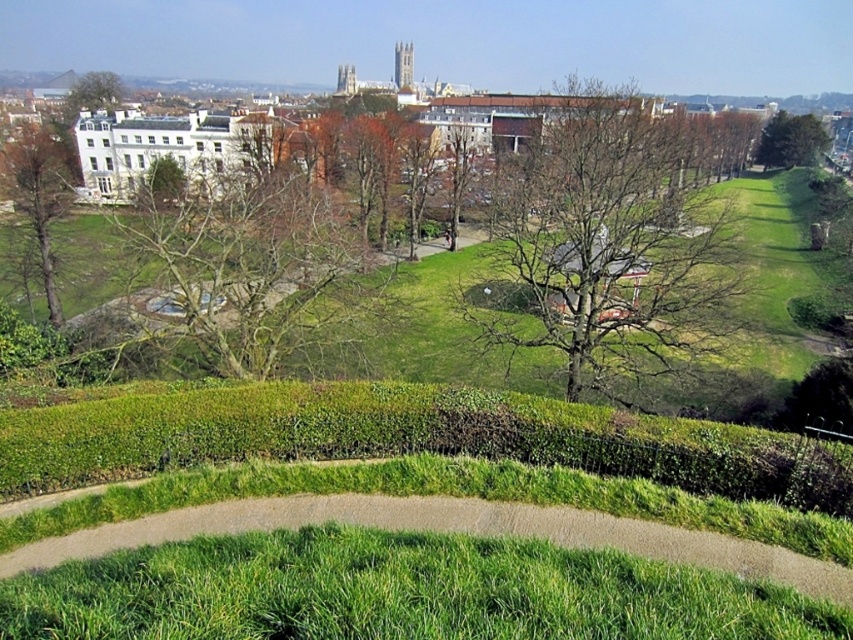
You are standing at the point marked by the coordinates (614, 243) in the park. Looking around, you see the grassy area with a curved pathway and hedges in the foreground. Which direction should you walk to reach the nearest leafless tree?

The point marked by the coordinates (614, 243) corresponds to the location of the bare wood tree at center. Therefore, you are already at the nearest leafless tree and do not need to move.

You are a park visitor who wants to take a photo of the bare wood tree at center and the bare branches at center from a distance. Which one will appear larger in the photo?

The bare wood tree at center will appear larger in the photo because it is much taller than the bare branches at center.

You are standing at the point marked by coordinates point (x=398, y=593) in the park. What is the surface you are currently standing on?

The surface at point (x=398, y=593) is green grass at lower center.